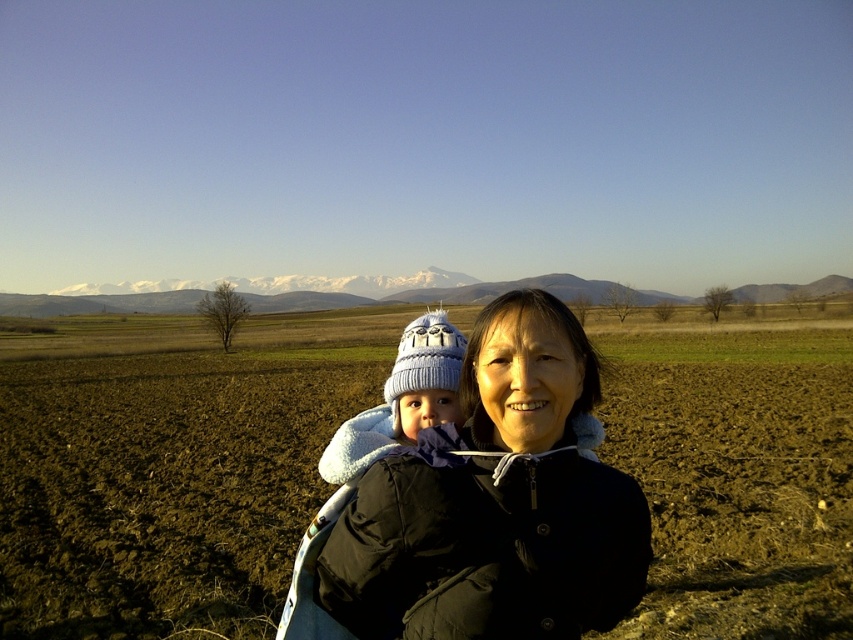
Does brown soil at center have a smaller size compared to black fleece jacket at center?

Actually, brown soil at center might be larger than black fleece jacket at center.

Is point (253, 486) in front of point (569, 600)?

That is False.

Locate an element on the screen. The width and height of the screenshot is (853, 640). brown soil at center is located at coordinates (170, 481).